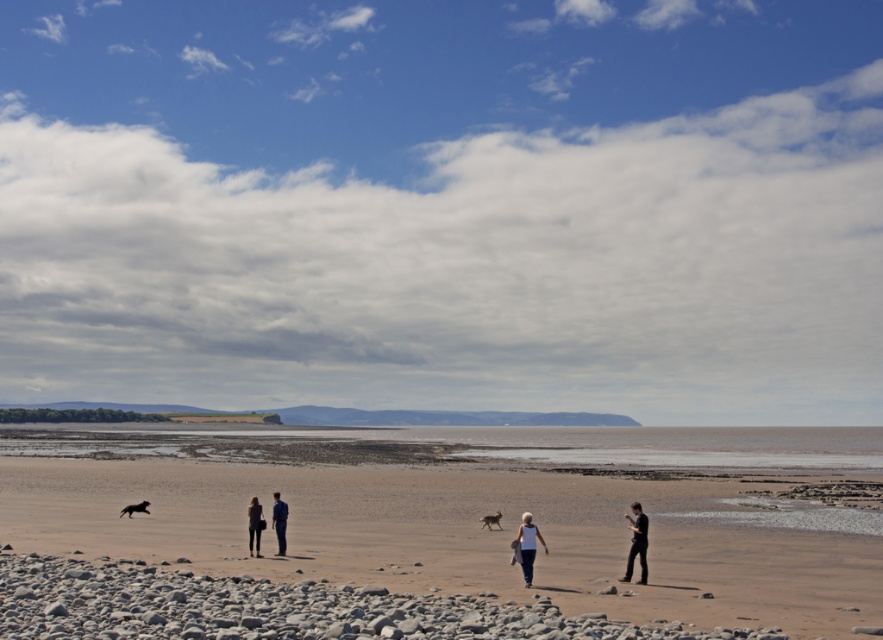
Question: Which object is farther from the camera taking this photo?

Choices:
 (A) black fur dog at lower left
 (B) dark blue jeans at lower right

Answer: (A)

Question: Does dark blue jeans at center appear under blue fabric jacket at center?

Choices:
 (A) yes
 (B) no

Answer: (B)

Question: Which of these objects is positioned closest to the black fur dog at lower left?

Choices:
 (A) blue fabric jacket at center
 (B) light brown sand at center
 (C) smooth pebble at lower left

Answer: (A)

Question: Is dark blue jeans at lower right positioned behind blue fabric jacket at center?

Choices:
 (A) yes
 (B) no

Answer: (B)

Question: Among these points, which one is farthest from the camera?

Choices:
 (A) (326, 612)
 (B) (402, 486)
 (C) (527, 538)

Answer: (B)

Question: Observing the image, what is the correct spatial positioning of light brown sand at center in reference to black fur dog at lower left?

Choices:
 (A) below
 (B) above

Answer: (A)